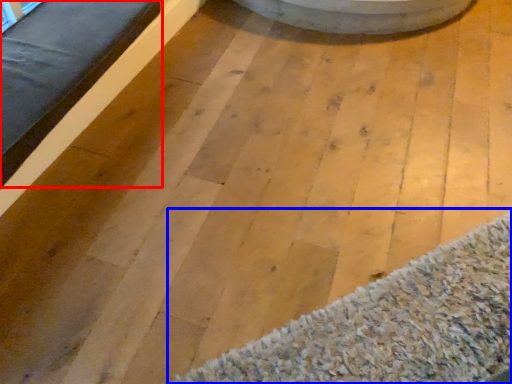
Question: Which object appears farthest to the camera in this image, furniture (highlighted by a red box) or mat (highlighted by a blue box)?

Choices:
 (A) furniture
 (B) mat

Answer: (A)